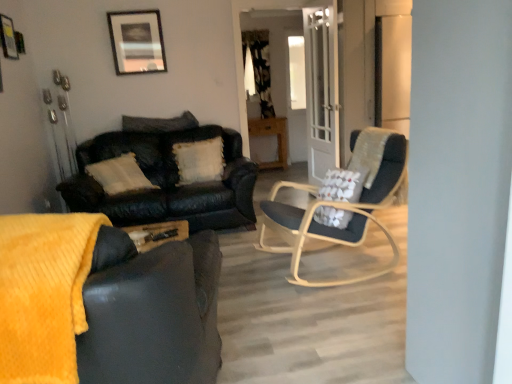
Question: Can you see matte black chair at center touching clear glass door at center?

Choices:
 (A) no
 (B) yes

Answer: (A)

Question: Is matte black chair at center taller than clear glass door at center?

Choices:
 (A) no
 (B) yes

Answer: (A)

Question: Is clear glass door at center completely or partially inside matte black chair at center?

Choices:
 (A) no
 (B) yes

Answer: (A)

Question: Considering the relative positions of matte black chair at center and clear glass door at center in the image provided, is matte black chair at center to the left of clear glass door at center from the viewer's perspective?

Choices:
 (A) no
 (B) yes

Answer: (B)

Question: Does matte black chair at center turn towards clear glass door at center?

Choices:
 (A) no
 (B) yes

Answer: (A)

Question: From a real-world perspective, relative to matte black chair at center, is black textured curtain at upper center vertically above or below?

Choices:
 (A) above
 (B) below

Answer: (A)

Question: Visually, is black textured curtain at upper center positioned to the left or to the right of matte black chair at center?

Choices:
 (A) right
 (B) left

Answer: (B)

Question: Does point (244, 52) appear closer or farther from the camera than point (315, 238)?

Choices:
 (A) closer
 (B) farther

Answer: (B)

Question: Is black textured curtain at upper center bigger or smaller than matte black chair at center?

Choices:
 (A) big
 (B) small

Answer: (B)

Question: Is matte black picture frame at upper center taller or shorter than wooden table at center?

Choices:
 (A) tall
 (B) short

Answer: (B)

Question: Based on their sizes in the image, would you say matte black picture frame at upper center is bigger or smaller than wooden table at center?

Choices:
 (A) small
 (B) big

Answer: (A)

Question: From the image's perspective, relative to wooden table at center, is matte black picture frame at upper center above or below?

Choices:
 (A) below
 (B) above

Answer: (B)

Question: Would you say matte black picture frame at upper center is to the left or to the right of wooden table at center in the picture?

Choices:
 (A) left
 (B) right

Answer: (A)

Question: Based on their sizes in the image, would you say clear glass door at center is bigger or smaller than white fluffy pillow at center, which is the 1th pillow in bottom-to-top order?

Choices:
 (A) small
 (B) big

Answer: (B)

Question: From a real-world perspective, is clear glass door at center physically located above or below white fluffy pillow at center, which is the 1th pillow in bottom-to-top order?

Choices:
 (A) below
 (B) above

Answer: (B)